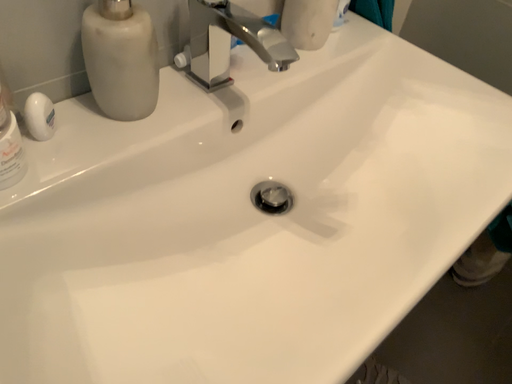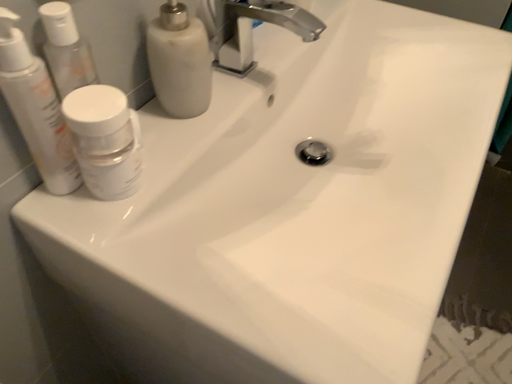
Question: Which way did the camera rotate in the video?

Choices:
 (A) rotated left
 (B) rotated right

Answer: (B)